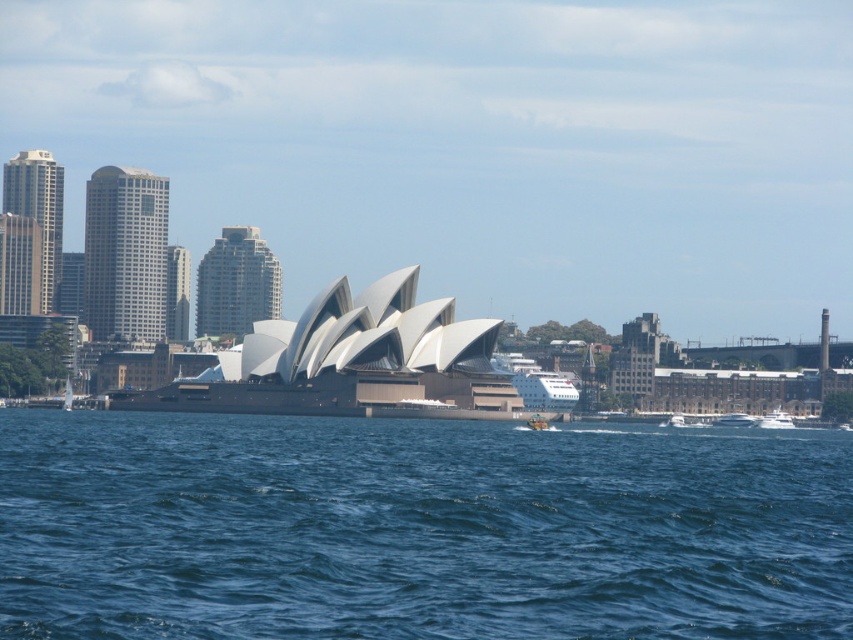
Question: Is blue water at center to the right of white matte boat at lower right from the viewer's perspective?

Choices:
 (A) no
 (B) yes

Answer: (A)

Question: Among these objects, which one is farthest from the camera?

Choices:
 (A) blue water at center
 (B) white glossy boat at lower right
 (C) white matte boat at lower right

Answer: (B)

Question: Which object is farther from the camera taking this photo?

Choices:
 (A) blue water at center
 (B) white glossy boat at lower right

Answer: (B)

Question: Which object is positioned closest to the white matte boat at lower right?

Choices:
 (A) blue water at center
 (B) white glossy boat at lower right

Answer: (B)

Question: Can you confirm if blue water at center is positioned to the left of white glossy boat at lower right?

Choices:
 (A) yes
 (B) no

Answer: (A)

Question: From the image, what is the correct spatial relationship of blue water at center in relation to white glossy boat at lower right?

Choices:
 (A) left
 (B) right

Answer: (A)